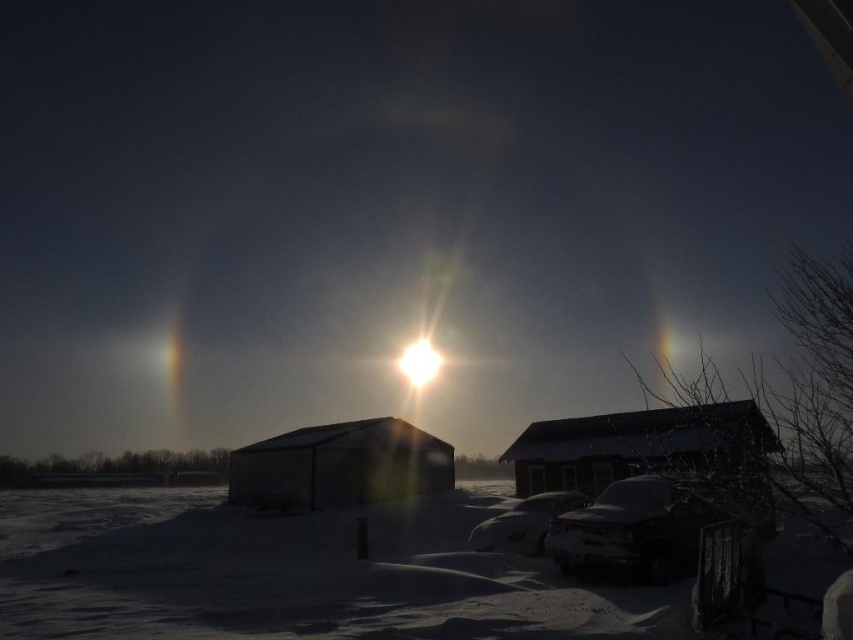
Question: Which of the following is the closest to the observer?

Choices:
 (A) red wooden barn at center
 (B) white frosty car at lower right
 (C) white fluffy snow at lower center

Answer: (A)

Question: Can you confirm if white frosty car at lower right is bigger than white glossy car at lower center?

Choices:
 (A) no
 (B) yes

Answer: (A)

Question: Which object is closer to the camera taking this photo?

Choices:
 (A) white frosty car at lower right
 (B) red wooden barn at center
 (C) white fluffy snow at lower center
 (D) white glossy car at lower center

Answer: (B)

Question: Can you confirm if white fluffy snow at lower center is positioned to the right of dark gray matte barn at center?

Choices:
 (A) no
 (B) yes

Answer: (A)

Question: Does white fluffy snow at lower center come behind white glossy car at lower center?

Choices:
 (A) yes
 (B) no

Answer: (B)

Question: Which is farther from the red wooden barn at center?

Choices:
 (A) white frosty car at lower right
 (B) white glossy car at lower center
 (C) white fluffy snow at lower center

Answer: (A)